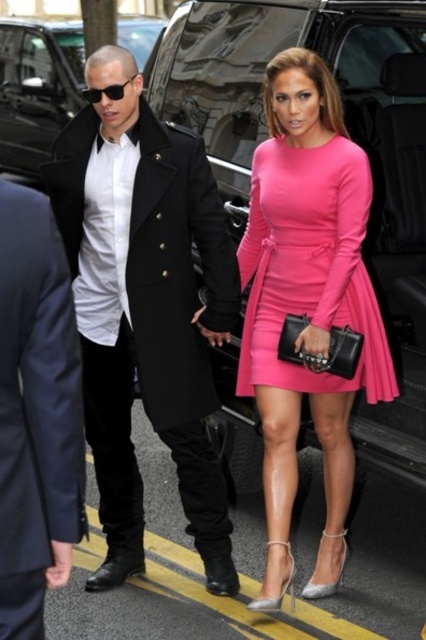
Who is more distant from viewer, (131,557) or (207,141)?

Positioned behind is point (207,141).

Is point (175, 422) less distant than point (213, 42)?

Yes, it is.

Is point (206, 240) closer to camera compared to point (259, 125)?

That is True.

In order to click on matte black coat at left in this screenshot , I will do `click(144, 307)`.

Between point (141, 252) and point (376, 368), which one is positioned in front?

Point (141, 252) is in front.

Is matte black coat at left below matte pink dress at center?

Indeed, matte black coat at left is positioned under matte pink dress at center.

Is point (140, 291) farther from camera compared to point (334, 208)?

Yes, it is.

Where is `matte black coat at left`? matte black coat at left is located at coordinates (144, 307).

Locate an element on the screen. This screenshot has width=426, height=640. pink satin dress at center is located at coordinates (307, 305).

Looking at this image, is pink satin dress at center to the right of dark blue wool suit at center from the viewer's perspective?

Yes, pink satin dress at center is to the right of dark blue wool suit at center.

The height and width of the screenshot is (640, 426). Describe the element at coordinates (307, 305) in the screenshot. I see `pink satin dress at center` at that location.

You are a GUI agent. You are given a task and a screenshot of the screen. Output one action in this format:
    pyautogui.click(x=<x>, y=<y>)
    Task: Click on the pink satin dress at center
    Image resolution: width=426 pixels, height=640 pixels.
    Given the screenshot: What is the action you would take?
    pyautogui.click(x=307, y=305)